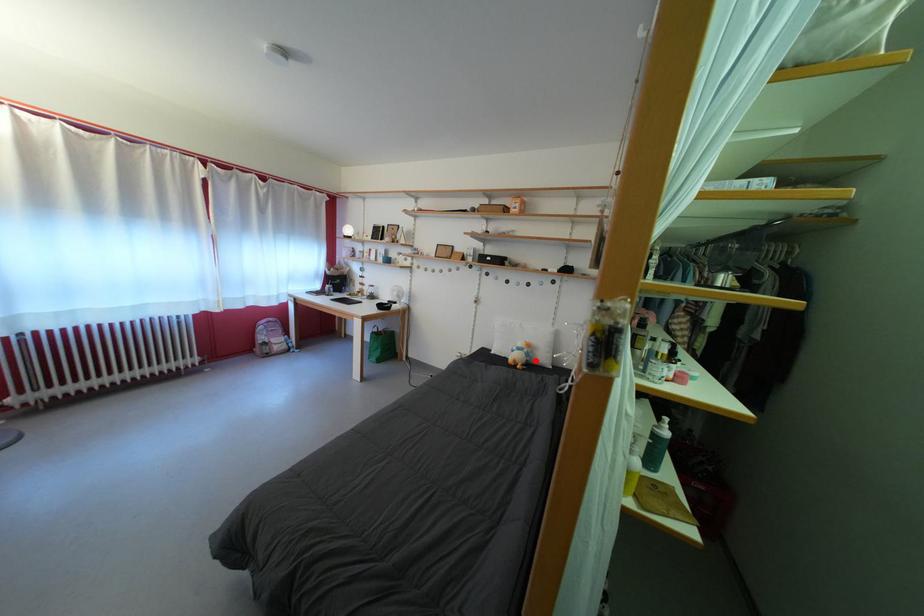
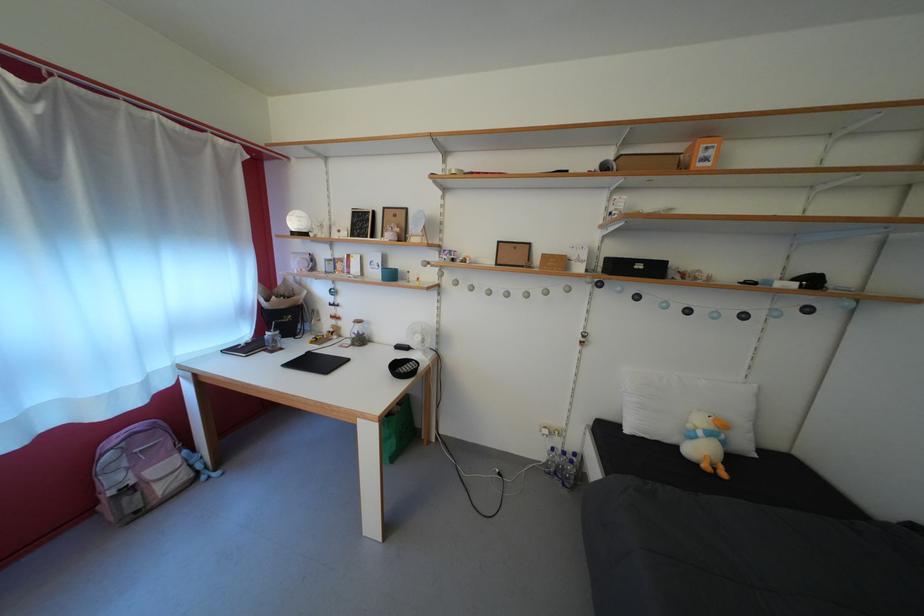
Find the pixel in the second image that matches the highlighted location in the first image.

(732, 448)